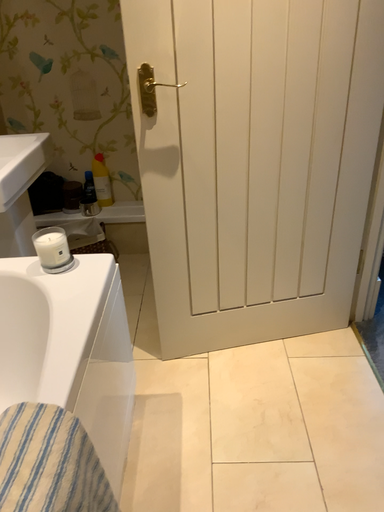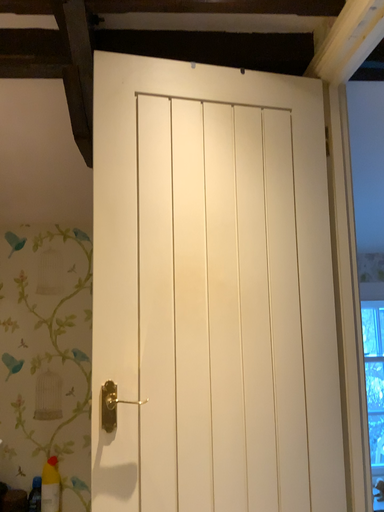
Question: Which way did the camera rotate in the video?

Choices:
 (A) rotated downward
 (B) rotated upward

Answer: (B)